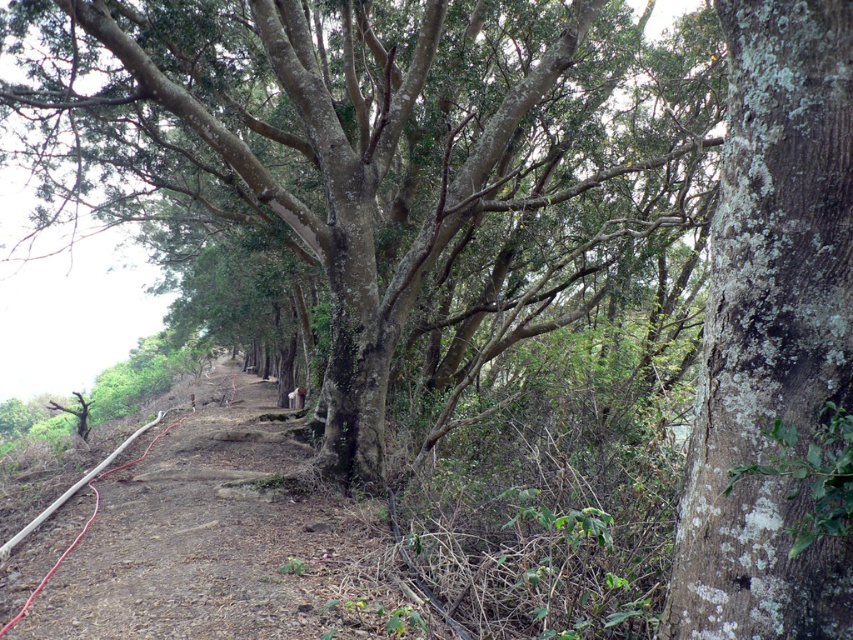
In the scene shown: Is lichen-covered tree trunk at center thinner than lichen-covered bark tree at right?

No, lichen-covered tree trunk at center is not thinner than lichen-covered bark tree at right.

Can you confirm if lichen-covered tree trunk at center is smaller than lichen-covered bark tree at right?

Actually, lichen-covered tree trunk at center might be larger than lichen-covered bark tree at right.

Does point (590, 113) come in front of point (793, 120)?

No, it is not.

The height and width of the screenshot is (640, 853). What are the coordinates of `lichen-covered tree trunk at center` in the screenshot? It's located at (376, 156).